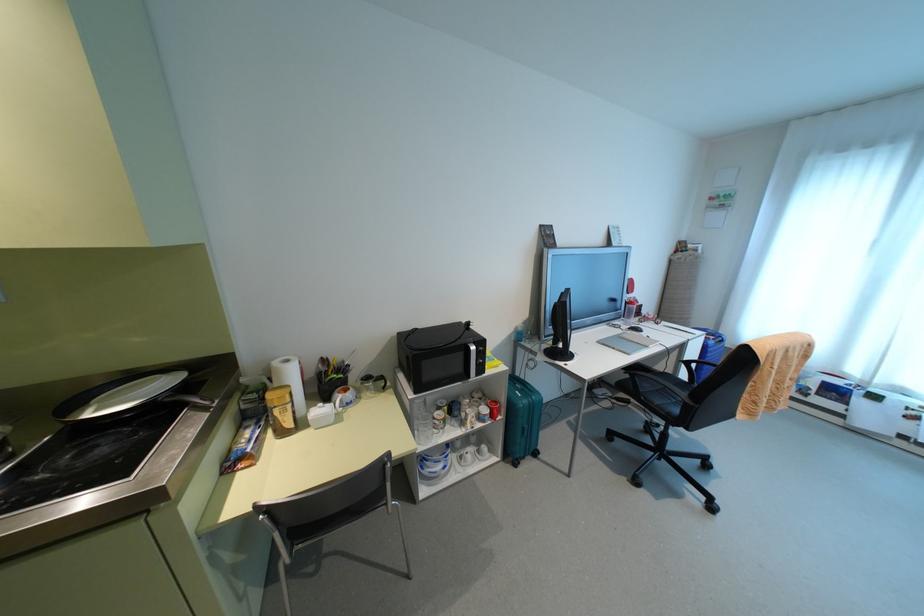
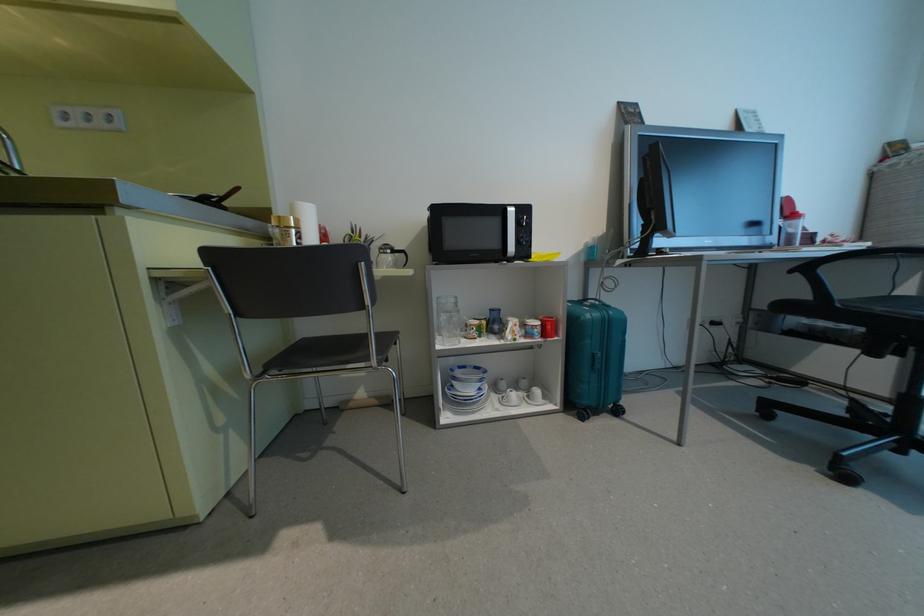
What movement of the cameraman would produce the second image?

The cameraman moved toward right, forward.